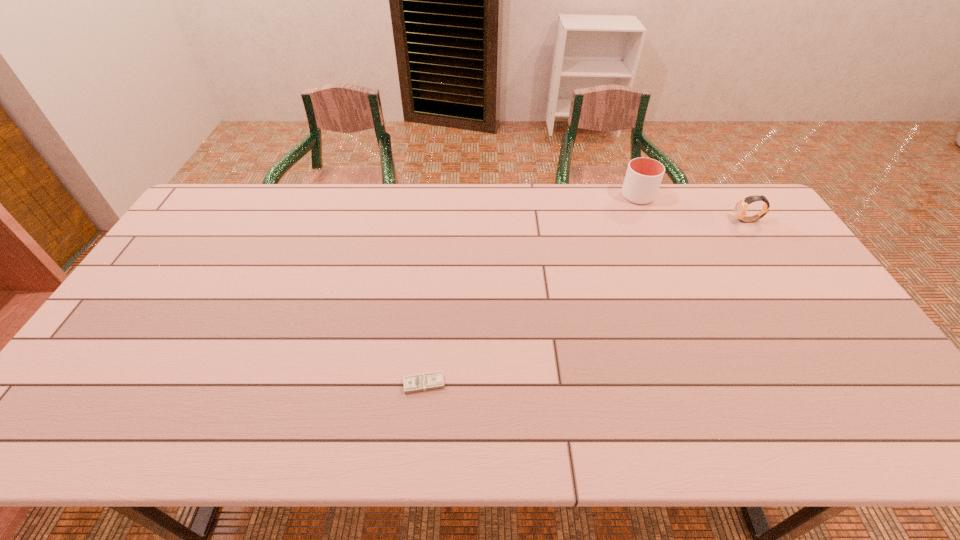
Identify the location of blank area located 0.220m on the left of the nearest object. (312, 383).

The width and height of the screenshot is (960, 540). Identify the location of cup that is at the far edge. (643, 178).

This screenshot has width=960, height=540. In order to click on watch that is at the far edge in this screenshot , I will do `click(741, 206)`.

Locate an element on the screen. The image size is (960, 540). object at the right edge is located at coordinates (741, 206).

Locate an element on the screen. Image resolution: width=960 pixels, height=540 pixels. object that is at the far right corner is located at coordinates (741, 206).

In the image, there is a desktop. Where is `free space at the far edge`? The width and height of the screenshot is (960, 540). free space at the far edge is located at coordinates (596, 185).

This screenshot has width=960, height=540. In order to click on vacant space at the near edge of the desktop in this screenshot , I will do `click(826, 418)`.

You are a GUI agent. You are given a task and a screenshot of the screen. Output one action in this format:
    pyautogui.click(x=<x>, y=<y>)
    Task: Click on the vacant space at the left edge
    Image resolution: width=960 pixels, height=540 pixels.
    Given the screenshot: What is the action you would take?
    pyautogui.click(x=136, y=389)

The height and width of the screenshot is (540, 960). I want to click on free space at the right edge of the desktop, so click(790, 297).

This screenshot has height=540, width=960. I want to click on empty location between the farthest object and the second shortest object, so (x=693, y=208).